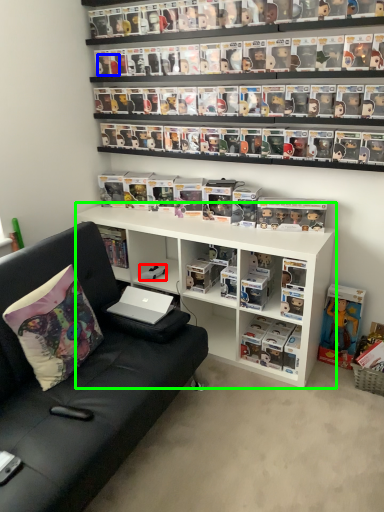
Question: Which object is positioned farthest from toy (highlighted by a red box)? Select from toy (highlighted by a blue box) and shelf (highlighted by a green box).

Choices:
 (A) toy
 (B) shelf

Answer: (A)